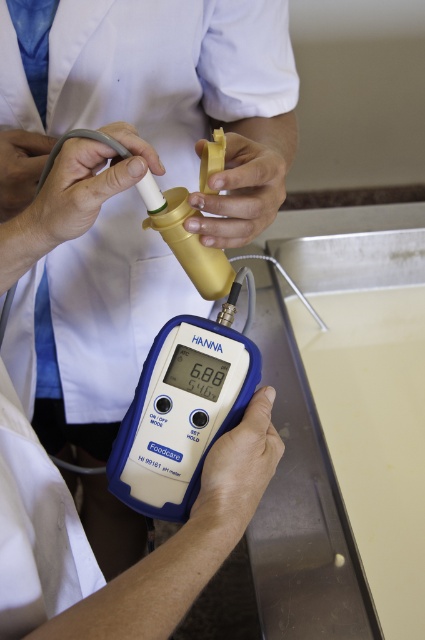
Can you confirm if matte yellow tube at center is bigger than matte blue digital meter at lower center?

Correct, matte yellow tube at center is larger in size than matte blue digital meter at lower center.

Who is more distant from viewer, (232, 212) or (238, 499)?

The point (232, 212) is behind.

Where is `matte yellow tube at center`? The height and width of the screenshot is (640, 425). matte yellow tube at center is located at coordinates (246, 180).

Based on the photo, is blue plastic scale at center smaller than matte gold tube at center?

Actually, blue plastic scale at center might be larger than matte gold tube at center.

Can you confirm if blue plastic scale at center is positioned above matte gold tube at center?

No, blue plastic scale at center is not above matte gold tube at center.

Is point (161, 339) positioned in front of point (19, 189)?

Yes, point (161, 339) is closer to viewer.

Where is `blue plastic scale at center`? The height and width of the screenshot is (640, 425). blue plastic scale at center is located at coordinates (180, 413).

How much distance is there between matte blue digital meter at lower center and matte gold tube at center?

29.35 centimeters

Based on the photo, does matte blue digital meter at lower center have a lesser width compared to matte gold tube at center?

In fact, matte blue digital meter at lower center might be wider than matte gold tube at center.

Locate an element on the screen. This screenshot has height=640, width=425. matte blue digital meter at lower center is located at coordinates (238, 470).